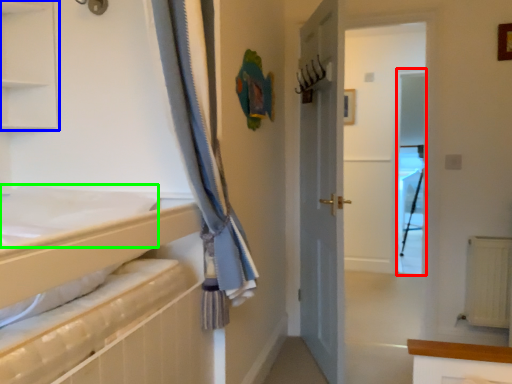
Question: Which object is positioned closest to screen door (highlighted by a red box)? Select from shelf (highlighted by a blue box) and sheet (highlighted by a green box).

Choices:
 (A) shelf
 (B) sheet

Answer: (A)